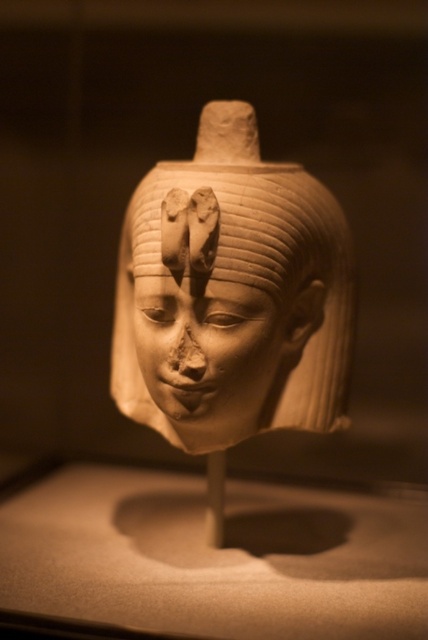
Who is lower down, matte beige statue at center or matte beige face at center?

matte beige face at center

Which of these two, matte beige statue at center or matte beige face at center, stands shorter?

matte beige face at center

Where is `matte beige statue at center`? matte beige statue at center is located at coordinates (231, 292).

Locate an element on the screen. matte beige statue at center is located at coordinates (231, 292).